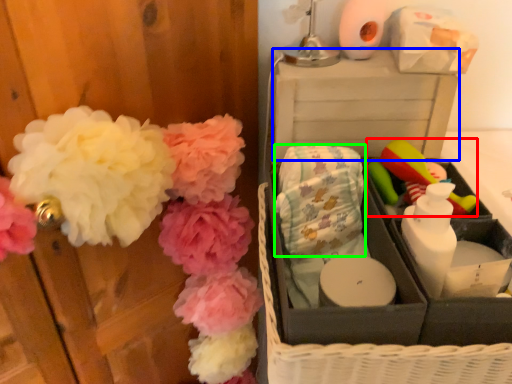
Question: Considering the real-world distances, which object is farthest from toy (highlighted by a red box)? storage box (highlighted by a blue box) or material (highlighted by a green box)?

Choices:
 (A) storage box
 (B) material

Answer: (B)